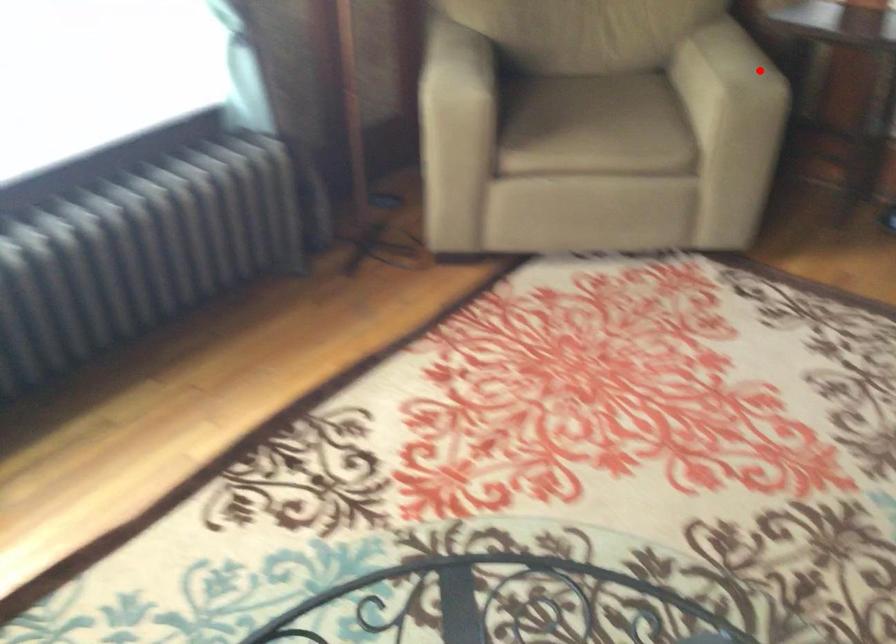
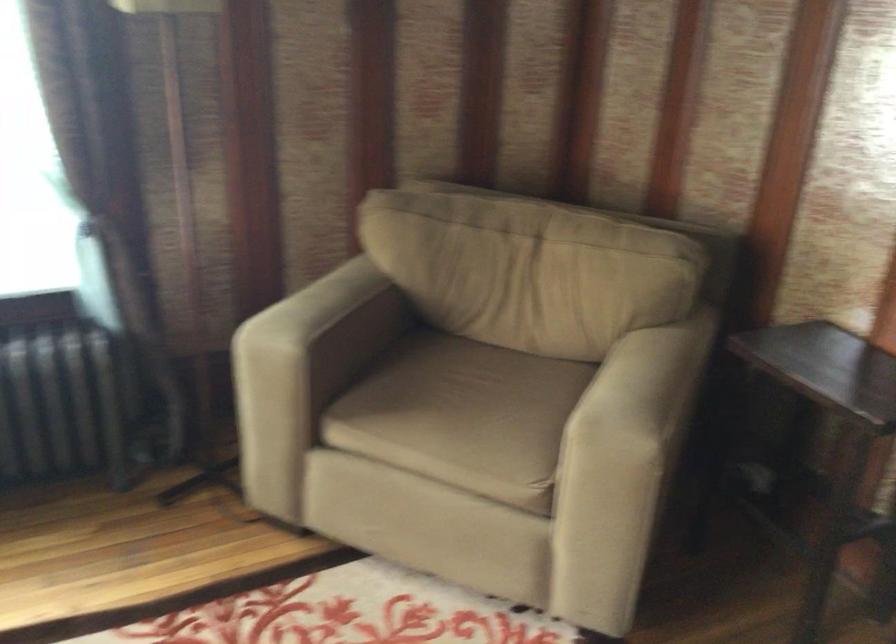
The point at the highlighted location is marked in the first image. Where is the corresponding point in the second image?

(640, 413)